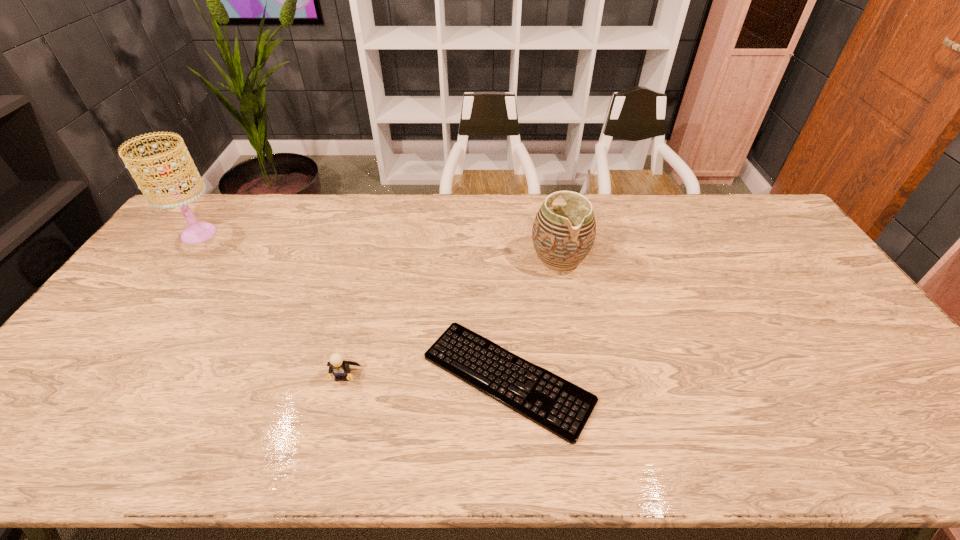
This screenshot has width=960, height=540. In order to click on object that is at the far edge in this screenshot , I will do `click(197, 232)`.

The width and height of the screenshot is (960, 540). What are the coordinates of `object located in the near edge section of the desktop` in the screenshot? It's located at click(x=557, y=405).

Identify the location of object positioned at the left edge. (197, 232).

At what (x,y) coordinates should I click in order to perform the action: click on object that is at the far left corner. Please return your answer as a coordinate pair (x, y). Looking at the image, I should click on (197, 232).

In the image, there is a desktop. Identify the location of free space at the far edge. This screenshot has height=540, width=960. (x=248, y=209).

You are a GUI agent. You are given a task and a screenshot of the screen. Output one action in this format:
    pyautogui.click(x=<x>, y=<y>)
    Task: Click on the blank space at the near edge
    Image resolution: width=960 pixels, height=540 pixels.
    Given the screenshot: What is the action you would take?
    pyautogui.click(x=725, y=448)

Where is `free space at the left edge`? This screenshot has width=960, height=540. free space at the left edge is located at coordinates (118, 330).

Identify the location of vacant space at the right edge of the desktop. (835, 352).

In the image, there is a desktop. At what (x,y) coordinates should I click in order to perform the action: click on free region at the near left corner. Please return your answer as a coordinate pair (x, y). Looking at the image, I should click on (68, 444).

You are a GUI agent. You are given a task and a screenshot of the screen. Output one action in this format:
    pyautogui.click(x=<x>, y=<y>)
    Task: Click on the vacant area that lies between the second tallest object and the shortest object
    The height and width of the screenshot is (540, 960).
    Given the screenshot: What is the action you would take?
    pyautogui.click(x=534, y=318)